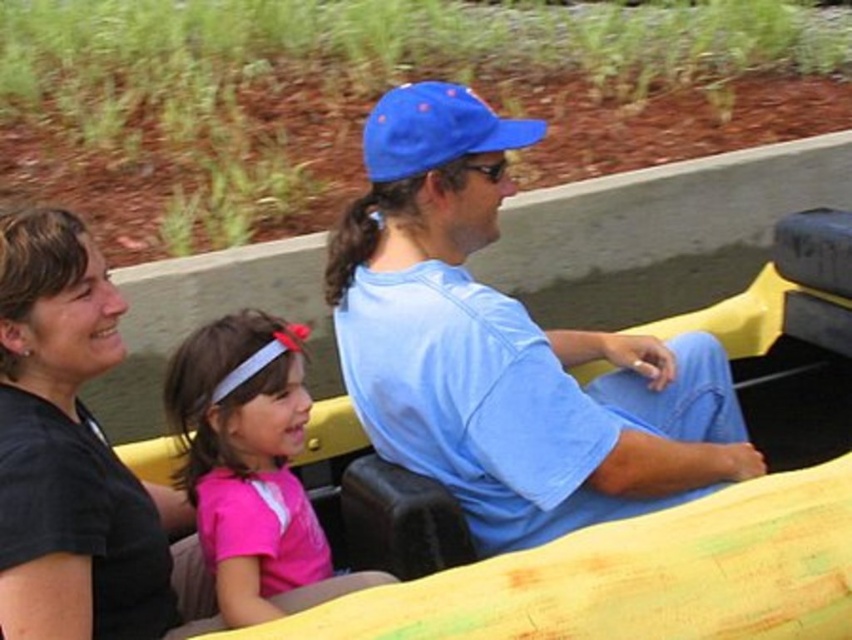
Question: Which point is closer to the camera?

Choices:
 (A) (665, 497)
 (B) (367, 172)
 (C) (98, 563)
 (D) (255, 492)

Answer: (C)

Question: Estimate the real-world distances between objects in this image. Which object is closer to the blue fabric cap at center?

Choices:
 (A) blue fabric baseball cap at center
 (B) pink matte shirt at center

Answer: (B)

Question: Considering the relative positions of black matte shirt at upper left and pink matte shirt at center in the image provided, where is black matte shirt at upper left located with respect to pink matte shirt at center?

Choices:
 (A) below
 (B) above

Answer: (B)

Question: Considering the relative positions of blue fabric cap at center and black matte shirt at upper left in the image provided, where is blue fabric cap at center located with respect to black matte shirt at upper left?

Choices:
 (A) above
 (B) below

Answer: (A)

Question: Considering the relative positions of black matte shirt at upper left and blue fabric baseball cap at center in the image provided, where is black matte shirt at upper left located with respect to blue fabric baseball cap at center?

Choices:
 (A) above
 (B) below

Answer: (B)

Question: Which is farther from the blue fabric cap at center?

Choices:
 (A) blue fabric baseball cap at center
 (B) black matte shirt at upper left

Answer: (B)